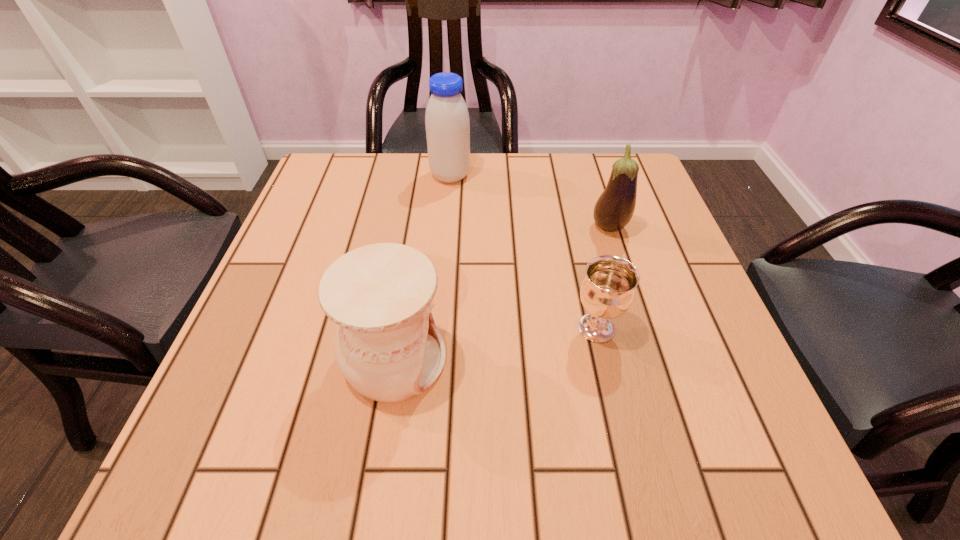
Identify the location of empty location between the tallest object and the shortest object. The width and height of the screenshot is (960, 540). (523, 252).

Locate an element on the screen. This screenshot has width=960, height=540. vacant area between the pottery and the shortest object is located at coordinates (495, 344).

The width and height of the screenshot is (960, 540). Find the location of `vacant space that's between the eggplant and the pottery`. vacant space that's between the eggplant and the pottery is located at coordinates (502, 294).

The height and width of the screenshot is (540, 960). Identify the location of vacant area that lies between the pottery and the second farthest object. (502, 294).

Image resolution: width=960 pixels, height=540 pixels. What are the coordinates of `empty location between the second farthest object and the tallest object` in the screenshot? It's located at (530, 202).

The image size is (960, 540). I want to click on vacant region between the pottery and the shortest object, so click(495, 344).

At what (x,y) coordinates should I click in order to perform the action: click on object that is the closest to the eggplant. Please return your answer as a coordinate pair (x, y). The image size is (960, 540). Looking at the image, I should click on (607, 291).

Where is `the second closest object to the chalice`? The height and width of the screenshot is (540, 960). the second closest object to the chalice is located at coordinates (387, 346).

Locate an element on the screen. The height and width of the screenshot is (540, 960). free region that satisfies the following two spatial constraints: 1. on the front side of the shortest object; 2. at the open side of the pottery is located at coordinates (603, 360).

Where is `free space that satisfies the following two spatial constraints: 1. on the front side of the second farthest object; 2. at the open side of the pottery`? Image resolution: width=960 pixels, height=540 pixels. free space that satisfies the following two spatial constraints: 1. on the front side of the second farthest object; 2. at the open side of the pottery is located at coordinates (651, 360).